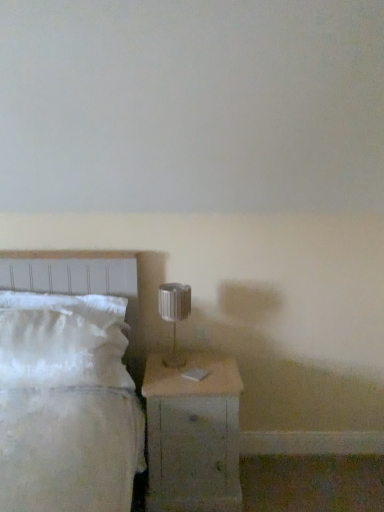
Locate an element on the screen. free space above wooden nightstand at lower right (from a real-world perspective) is located at coordinates (196, 366).